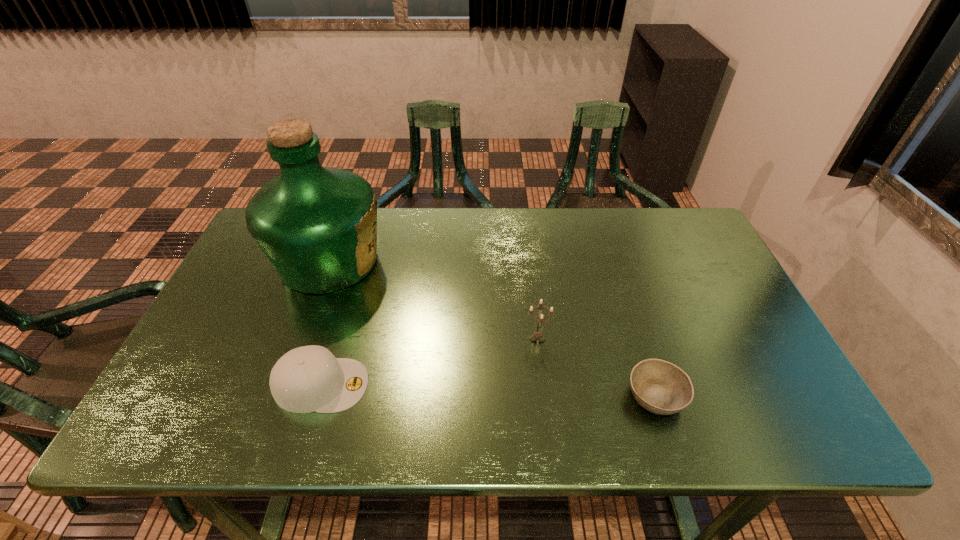
Where is `vacant area situated 0.100m on the right of the shortest object`? The image size is (960, 540). vacant area situated 0.100m on the right of the shortest object is located at coordinates (730, 396).

Identify the location of object that is at the far edge. (317, 226).

At what (x,y) coordinates should I click in order to perform the action: click on cap that is at the near edge. Please return your answer as a coordinate pair (x, y). The width and height of the screenshot is (960, 540). Looking at the image, I should click on (309, 378).

At what (x,y) coordinates should I click in order to perform the action: click on bowl that is at the near edge. Please return your answer as a coordinate pair (x, y). This screenshot has width=960, height=540. Looking at the image, I should click on (660, 387).

Where is `object that is at the left edge`? The image size is (960, 540). object that is at the left edge is located at coordinates (317, 226).

Where is `object at the far left corner`? The height and width of the screenshot is (540, 960). object at the far left corner is located at coordinates (317, 226).

I want to click on free region at the far edge of the desktop, so click(587, 244).

You are a GUI agent. You are given a task and a screenshot of the screen. Output one action in this format:
    pyautogui.click(x=<x>, y=<y>)
    Task: Click on the free region at the near edge
    The width and height of the screenshot is (960, 540).
    Given the screenshot: What is the action you would take?
    pyautogui.click(x=545, y=427)

Locate an element on the screen. vacant space at the left edge of the desktop is located at coordinates (229, 310).

Identify the location of vacant space at the right edge of the desktop. This screenshot has height=540, width=960. (699, 292).